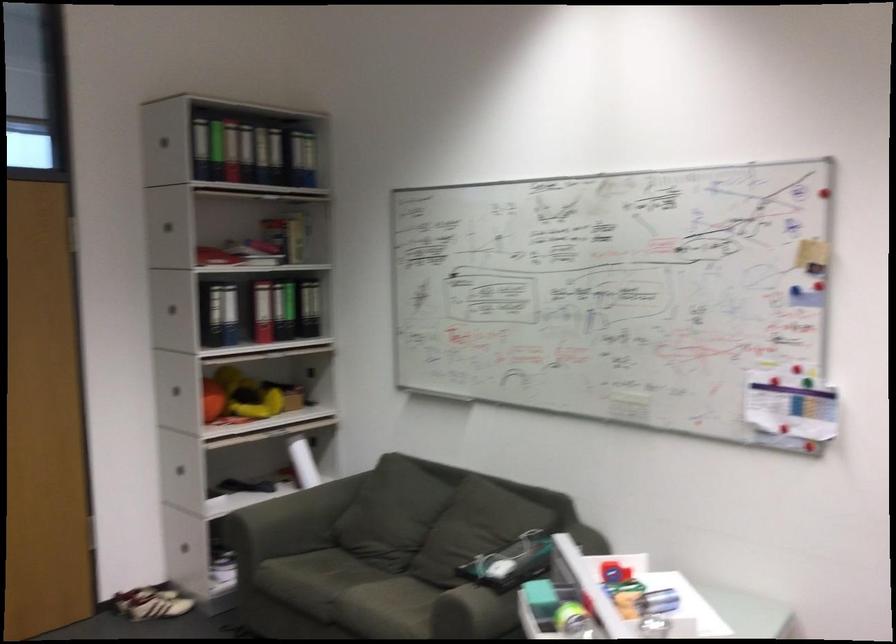
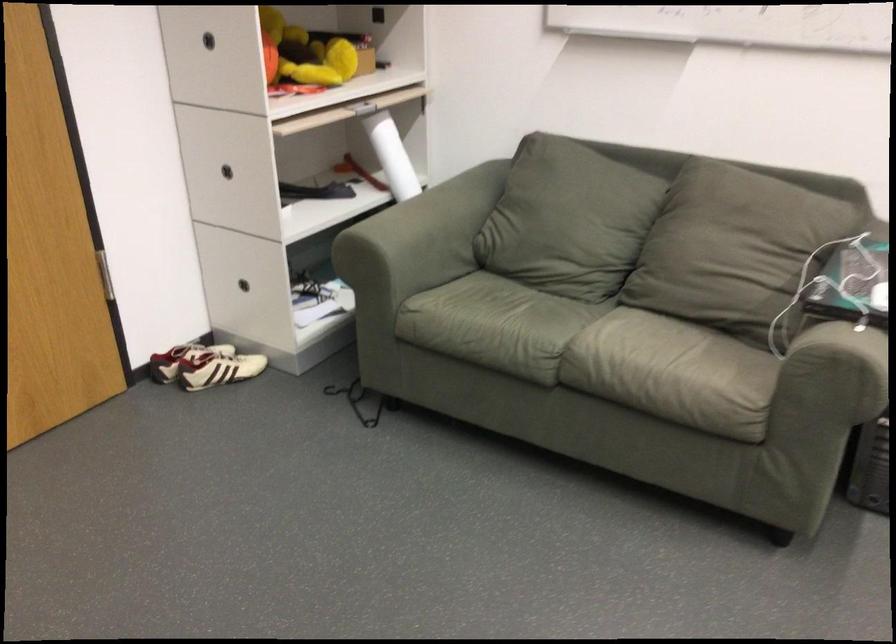
Question: I am providing you with two images of the same scene from different viewpoints. After the viewpoint changes to image2, which objects are now occluded?

Choices:
 (A) white and black shoe
 (B) laptop computer
 (C) white and red shoe
 (D) none of these

Answer: (D)